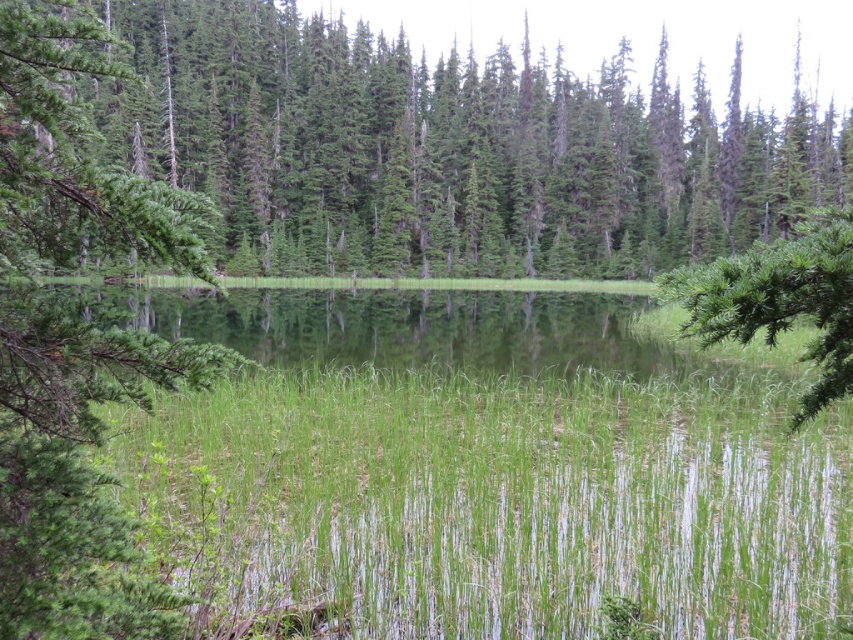
Is point (38, 74) closer to viewer compared to point (815, 387)?

Yes, it is.

Does green leafy branch at left have a lesser width compared to green needle-like at right?

Yes, green leafy branch at left is thinner than green needle-like at right.

Locate an element on the screen. The height and width of the screenshot is (640, 853). green leafy branch at left is located at coordinates (76, 468).

Find the location of a particular element. green matte tree at center is located at coordinates (392, 147).

Between point (608, 257) and point (21, 499), which one is positioned in front?

Point (21, 499) is more forward.

Identify the location of green matte tree at center. (392, 147).

Which is more to the right, green matte tree at center or green needle-like at right?

From the viewer's perspective, green needle-like at right appears more on the right side.

The height and width of the screenshot is (640, 853). Describe the element at coordinates (392, 147) in the screenshot. I see `green matte tree at center` at that location.

The height and width of the screenshot is (640, 853). I want to click on green matte tree at center, so click(392, 147).